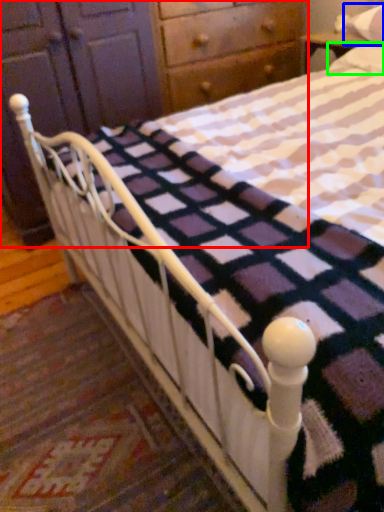
Question: Which object is positioned closest to dresser (highlighted by a red box)? Select from pillow (highlighted by a blue box) and pillow (highlighted by a green box).

Choices:
 (A) pillow
 (B) pillow

Answer: (B)